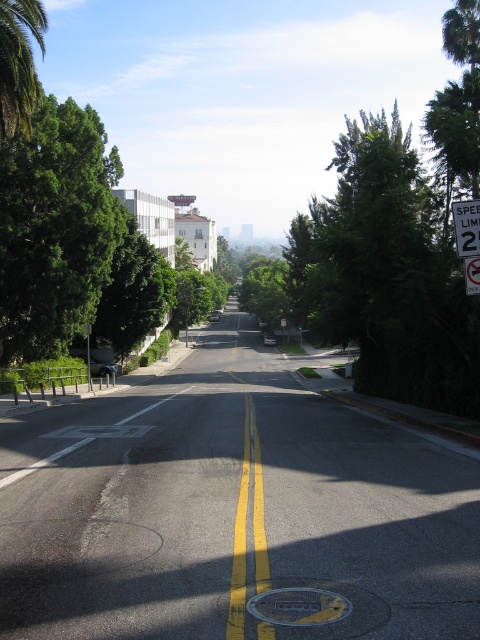
You are driving a truck that is 12 feet wide. You need to pass through the street shown in the image. The road has a center divider with double yellow lines. Considering the green leafy palm tree at upper left and the metal speed limit sign at right, which object would you need to avoid hitting if your truck is too wide to stay within the lane?

The green leafy palm tree at upper left has a larger size compared to the metal speed limit sign at right, so you should avoid hitting the green leafy palm tree at upper left as it poses a greater risk due to its larger size when navigating with a wide truck.

You are driving a car and see the green leafy palm tree at upper left and the metal speed limit sign at right. Which object is closer to you?

The green leafy palm tree at upper left is closer to you because the metal speed limit sign at right is behind it.

You are standing on the quiet urban street scene and want to walk from the point at coordinates point (15, 13) to the point at coordinates point (468, 268). Which direction should you face to move towards the second point?

You should face towards the bottom right of the image because point (468, 268) is located further away from the camera compared to point (15, 13), meaning it is positioned lower and to the right in the image.